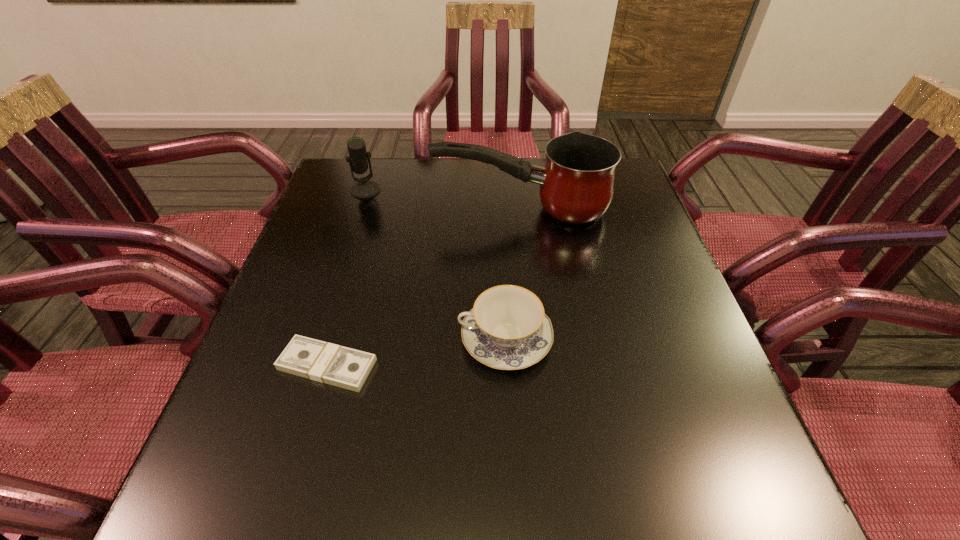
Image resolution: width=960 pixels, height=540 pixels. In order to click on saucepan in this screenshot , I will do `click(577, 183)`.

Identify the location of the second tallest object. The width and height of the screenshot is (960, 540). (364, 188).

You are a GUI agent. You are given a task and a screenshot of the screen. Output one action in this format:
    pyautogui.click(x=<x>, y=<y>)
    Task: Click on the chinaware
    The image size is (960, 540).
    Given the screenshot: What is the action you would take?
    pyautogui.click(x=507, y=329)

This screenshot has width=960, height=540. Find the location of `the shortest object`. the shortest object is located at coordinates (340, 366).

Identify the location of vacant space situated 0.230m on the handle side of the tallest object. This screenshot has width=960, height=540. (349, 209).

Find the location of a particular element. Image resolution: width=960 pixels, height=540 pixels. free space located on the handle side of the tallest object is located at coordinates (338, 209).

The height and width of the screenshot is (540, 960). Find the location of `vacant point located 0.280m on the handle side of the tallest object`. vacant point located 0.280m on the handle side of the tallest object is located at coordinates click(x=330, y=209).

Identify the location of free spot located on the front of the third shortest object. This screenshot has height=540, width=960. (351, 233).

At what (x,y) coordinates should I click in order to perform the action: click on free spot located 0.060m with the handle on the side of the chinaware. Please return your answer as a coordinate pair (x, y). This screenshot has height=540, width=960. Looking at the image, I should click on (429, 339).

The width and height of the screenshot is (960, 540). Identify the location of vacant space located 0.120m with the handle on the side of the chinaware. (399, 339).